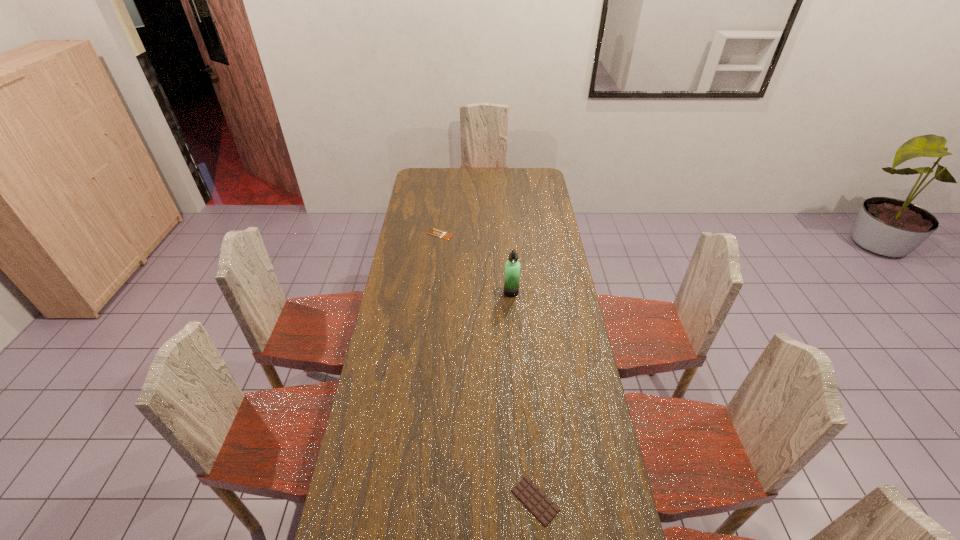
This screenshot has height=540, width=960. Find the location of `unoccupied area between the nearest object and the farthest object`. unoccupied area between the nearest object and the farthest object is located at coordinates (488, 367).

You are a GUI agent. You are given a task and a screenshot of the screen. Output one action in this format:
    pyautogui.click(x=<x>, y=<y>)
    Task: Click on the unoccupied position between the left chocolate bar and the right chocolate bar
    The width and height of the screenshot is (960, 540).
    Given the screenshot: What is the action you would take?
    [488, 367]

At what (x,y) coordinates should I click in order to perform the action: click on unoccupied area between the nearest object and the thermos bottle. Please return your answer as a coordinate pair (x, y). Looking at the image, I should click on coord(523,396).

Image resolution: width=960 pixels, height=540 pixels. Find the location of `vacant space that's between the leftmost object and the second nearest object`. vacant space that's between the leftmost object and the second nearest object is located at coordinates (476, 263).

The height and width of the screenshot is (540, 960). I want to click on object that ranks as the second closest to the left chocolate bar, so click(532, 497).

At what (x,y) coordinates should I click in order to perform the action: click on the closest object to the second nearest object. Please return your answer as a coordinate pair (x, y). Looking at the image, I should click on (435, 232).

At what (x,y) coordinates should I click in order to perform the action: click on free space that satisfies the following two spatial constraints: 1. on the front side of the nearer chocolate bar; 2. on the left side of the farther chocolate bar. Please return your answer as a coordinate pair (x, y). Looking at the image, I should click on (410, 501).

I want to click on vacant region that satisfies the following two spatial constraints: 1. on the front side of the shorter chocolate bar; 2. on the right side of the nearest object, so click(410, 501).